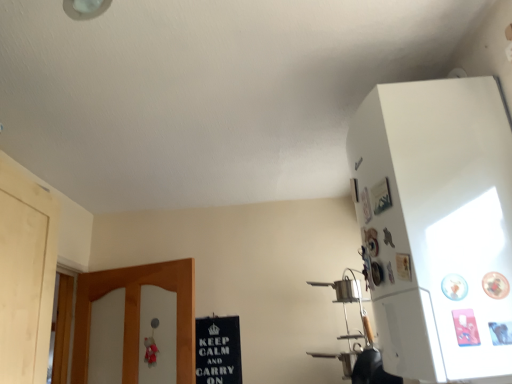
Question: Based on their positions, is black cardboard sign at lower center located to the left or right of white matte refrigerator at upper right?

Choices:
 (A) right
 (B) left

Answer: (B)

Question: From a real-world perspective, is black cardboard sign at lower center above or below white matte refrigerator at upper right?

Choices:
 (A) above
 (B) below

Answer: (B)

Question: In terms of height, does black cardboard sign at lower center look taller or shorter compared to white matte refrigerator at upper right?

Choices:
 (A) tall
 (B) short

Answer: (B)

Question: Would you say white matte refrigerator at upper right is to the left or to the right of black cardboard sign at lower center in the picture?

Choices:
 (A) left
 (B) right

Answer: (B)

Question: From a real-world perspective, relative to black cardboard sign at lower center, is white matte refrigerator at upper right vertically above or below?

Choices:
 (A) below
 (B) above

Answer: (B)

Question: In terms of size, does white matte refrigerator at upper right appear bigger or smaller than black cardboard sign at lower center?

Choices:
 (A) big
 (B) small

Answer: (A)

Question: From their relative heights in the image, would you say white matte refrigerator at upper right is taller or shorter than black cardboard sign at lower center?

Choices:
 (A) short
 (B) tall

Answer: (B)